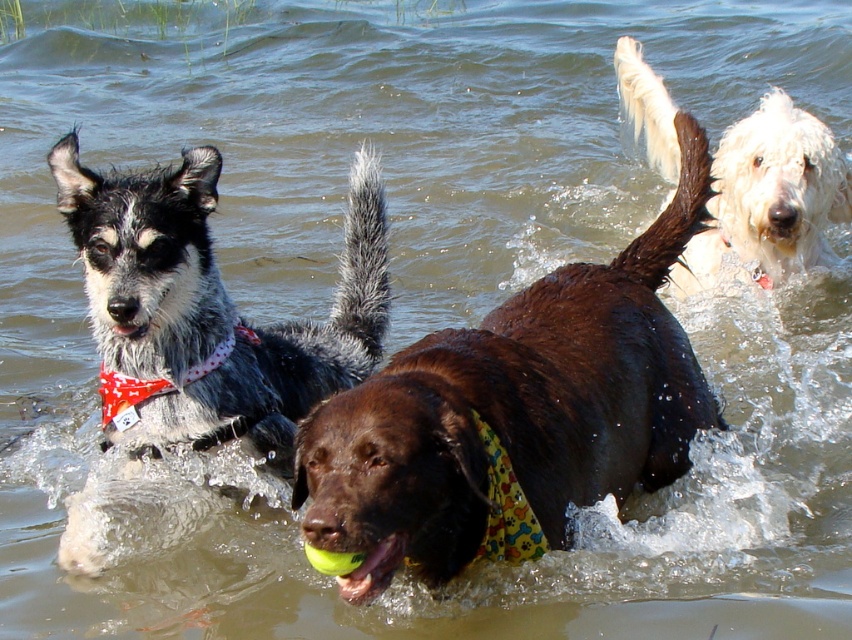
Does spotted fur dog at left come in front of yellow rubber ball at center?

No, spotted fur dog at left is further to the viewer.

Describe the element at coordinates (210, 310) in the screenshot. I see `spotted fur dog at left` at that location.

The height and width of the screenshot is (640, 852). Find the location of `spotted fur dog at left`. spotted fur dog at left is located at coordinates (210, 310).

Is point (714, 260) closer to camera compared to point (369, 564)?

That is False.

Is white fluffy dog at upper right behind yellow rubber ball at center?

Yes, white fluffy dog at upper right is behind yellow rubber ball at center.

Which is behind, point (659, 150) or point (387, 568)?

Positioned behind is point (659, 150).

This screenshot has height=640, width=852. In order to click on white fluffy dog at upper right in this screenshot , I will do `click(769, 198)`.

From the picture: Between brown shiny dog at center and spotted fur dog at left, which one appears on the left side from the viewer's perspective?

From the viewer's perspective, spotted fur dog at left appears more on the left side.

Is brown shiny dog at center above spotted fur dog at left?

Incorrect, brown shiny dog at center is not positioned above spotted fur dog at left.

Describe the element at coordinates (517, 410) in the screenshot. This screenshot has height=640, width=852. I see `brown shiny dog at center` at that location.

Locate an element on the screen. The image size is (852, 640). brown shiny dog at center is located at coordinates (517, 410).